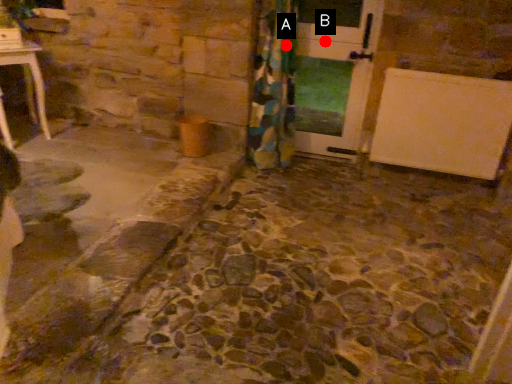
Question: Two points are circled on the image, labeled by A and B beside each circle. Among these points, which one is farthest from the camera?

Choices:
 (A) A is further
 (B) B is further

Answer: (B)